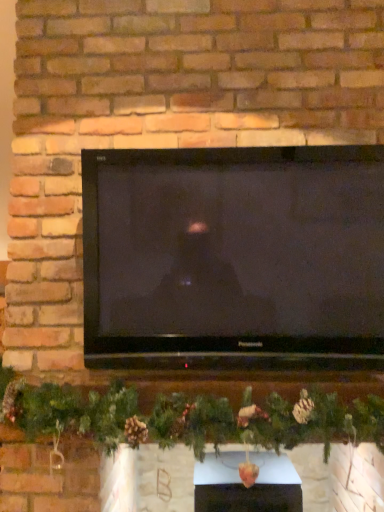
Question: Does white glossy fireplace at center have a greater height compared to black glossy tv at center?

Choices:
 (A) yes
 (B) no

Answer: (B)

Question: Considering the relative positions of white glossy fireplace at center and black glossy tv at center in the image provided, is white glossy fireplace at center to the right of black glossy tv at center from the viewer's perspective?

Choices:
 (A) yes
 (B) no

Answer: (A)

Question: Could you tell me if white glossy fireplace at center is turned towards black glossy tv at center?

Choices:
 (A) yes
 (B) no

Answer: (B)

Question: Is white glossy fireplace at center thinner than black glossy tv at center?

Choices:
 (A) yes
 (B) no

Answer: (B)

Question: Is white glossy fireplace at center positioned in front of black glossy tv at center?

Choices:
 (A) no
 (B) yes

Answer: (A)

Question: Is white glossy fireplace at center inside the boundaries of green matte garland at center, or outside?

Choices:
 (A) outside
 (B) inside

Answer: (A)

Question: Considering the relative positions of white glossy fireplace at center and green matte garland at center in the image provided, is white glossy fireplace at center to the left or to the right of green matte garland at center?

Choices:
 (A) left
 (B) right

Answer: (B)

Question: Looking at their shapes, would you say white glossy fireplace at center is wider or thinner than green matte garland at center?

Choices:
 (A) wide
 (B) thin

Answer: (B)

Question: Based on their sizes in the image, would you say white glossy fireplace at center is bigger or smaller than green matte garland at center?

Choices:
 (A) small
 (B) big

Answer: (A)

Question: Do you think black glossy tv at center is within green matte garland at center, or outside of it?

Choices:
 (A) outside
 (B) inside

Answer: (A)

Question: Considering the positions of black glossy tv at center and green matte garland at center in the image, is black glossy tv at center taller or shorter than green matte garland at center?

Choices:
 (A) short
 (B) tall

Answer: (B)

Question: From a real-world perspective, relative to green matte garland at center, is black glossy tv at center vertically above or below?

Choices:
 (A) below
 (B) above

Answer: (B)

Question: From the image's perspective, is black glossy tv at center above or below green matte garland at center?

Choices:
 (A) above
 (B) below

Answer: (A)

Question: Is black glossy tv at center bigger or smaller than white glossy fireplace at center?

Choices:
 (A) small
 (B) big

Answer: (B)

Question: From their relative heights in the image, would you say black glossy tv at center is taller or shorter than white glossy fireplace at center?

Choices:
 (A) tall
 (B) short

Answer: (A)